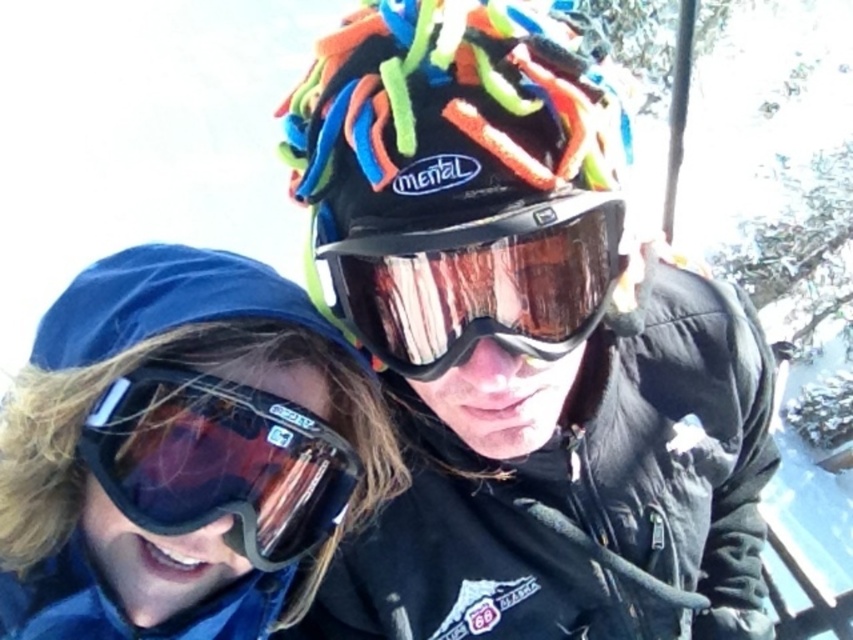
Question: Estimate the real-world distances between objects in this image. Which object is farther from the multicolored knit beanie at center?

Choices:
 (A) transparent reflective goggles at center
 (B) transparent plastic goggles at lower left

Answer: (B)

Question: Which point appears closest to the camera in this image?

Choices:
 (A) (340, 467)
 (B) (514, 330)

Answer: (B)

Question: Does multicolored knit beanie at center lie behind transparent reflective goggles at center?

Choices:
 (A) no
 (B) yes

Answer: (A)

Question: Considering the real-world distances, which object is farthest from the transparent reflective goggles at center?

Choices:
 (A) transparent plastic goggles at lower left
 (B) multicolored knit beanie at center

Answer: (A)

Question: From the image, what is the correct spatial relationship of multicolored knit beanie at center in relation to transparent plastic goggles at lower left?

Choices:
 (A) left
 (B) right

Answer: (B)

Question: Does multicolored knit beanie at center have a greater width compared to transparent plastic goggles at lower left?

Choices:
 (A) no
 (B) yes

Answer: (B)